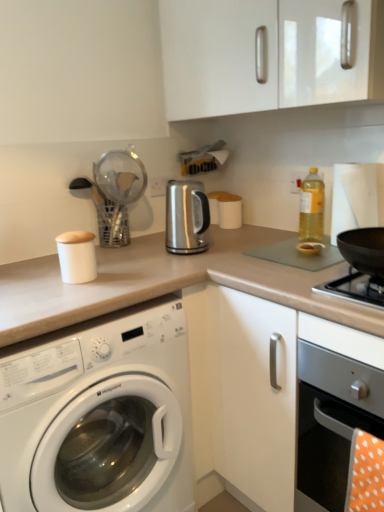
The image size is (384, 512). What do you see at coordinates (186, 217) in the screenshot? I see `satin metallic kettle at center, which is counted as the first appliance, starting from the right` at bounding box center [186, 217].

This screenshot has height=512, width=384. What are the coordinates of `white glossy cabinet at upper center` in the screenshot? It's located at (267, 54).

What do you see at coordinates (267, 54) in the screenshot? I see `white glossy cabinet at upper center` at bounding box center [267, 54].

In order to face white glossy washing machine at lower left, should I rotate leftwards or rightwards?

Rotate left and turn 14.771 degrees.

This screenshot has width=384, height=512. What do you see at coordinates (311, 207) in the screenshot?
I see `yellow translucent bottle at upper right` at bounding box center [311, 207].

Identify the location of black matte wok at right. (363, 249).

The height and width of the screenshot is (512, 384). Find the location of `satin silver oven at lower right`. satin silver oven at lower right is located at coordinates (334, 406).

I want to click on satin metallic kettle at center, acting as the 1th appliance starting from the back, so click(186, 217).

Are white matte canister at left, the 1th appliance positioned from the front, and satin metallic kettle at center, which is the second appliance from left to right, beside each other?

white matte canister at left, the 1th appliance positioned from the front, is not next to satin metallic kettle at center, which is the second appliance from left to right, and they're not touching.

Looking at their sizes, would you say white matte canister at left, the 1th appliance from the left, is wider or thinner than satin metallic kettle at center, which is counted as the first appliance, starting from the right?

In the image, white matte canister at left, the 1th appliance from the left, appears to be more narrow than satin metallic kettle at center, which is counted as the first appliance, starting from the right.

Consider the image. From a real-world perspective, is white matte canister at left, the 1th appliance positioned from the front, on top of satin metallic kettle at center, which is the second appliance from left to right?

No, from a real-world perspective, white matte canister at left, the 1th appliance positioned from the front, is not over satin metallic kettle at center, which is the second appliance from left to right

Considering the positions of point (93, 269) and point (173, 197), is point (93, 269) closer or farther from the camera than point (173, 197)?

Point (93, 269).

Is black matte wok at right inside the boundaries of white glossy cabinet at upper center, or outside?

black matte wok at right is located beyond the bounds of white glossy cabinet at upper center.

How different are the orientations of black matte wok at right and white glossy cabinet at upper center in degrees?

The angular difference between black matte wok at right and white glossy cabinet at upper center is 0.00441 degrees.

Is black matte wok at right to the left of white glossy cabinet at upper center from the viewer's perspective?

In fact, black matte wok at right is to the right of white glossy cabinet at upper center.

Considering the relative sizes of white matte canister at left, the second appliance positioned from the right, and satin silver oven at lower right in the image provided, is white matte canister at left, the second appliance positioned from the right, bigger than satin silver oven at lower right?

Actually, white matte canister at left, the second appliance positioned from the right, might be smaller than satin silver oven at lower right.

Which is behind, white matte canister at left, the 1th appliance from the left, or satin silver oven at lower right?

white matte canister at left, the 1th appliance from the left, is further from the camera.

Is white matte canister at left, positioned as the second appliance in back-to-front order, positioned beyond the bounds of satin silver oven at lower right?

That's correct, white matte canister at left, positioned as the second appliance in back-to-front order, is outside of satin silver oven at lower right.

Considering the positions of objects white glossy washing machine at lower left and satin silver oven at lower right in the image provided, who is more to the left, white glossy washing machine at lower left or satin silver oven at lower right?

From the viewer's perspective, white glossy washing machine at lower left appears more on the left side.

From the image's perspective, which is above, white glossy washing machine at lower left or satin silver oven at lower right?

satin silver oven at lower right appears higher in the image.

Is white glossy washing machine at lower left positioned beyond the bounds of satin silver oven at lower right?

Yes.

Would you say yellow translucent bottle at upper right is to the left or to the right of black matte wok at right in the picture?

Based on their positions, yellow translucent bottle at upper right is located to the left of black matte wok at right.

Is black matte wok at right inside yellow translucent bottle at upper right?

No.

In terms of width, does yellow translucent bottle at upper right look wider or thinner when compared to black matte wok at right?

Clearly, yellow translucent bottle at upper right has less width compared to black matte wok at right.

Identify the location of bottle behind the black matte wok at right. The width and height of the screenshot is (384, 512). (311, 207).

From the image's perspective, does white glossy cabinet at upper center appear higher than satin silver oven at lower right?

Yes, from the image's perspective, white glossy cabinet at upper center is on top of satin silver oven at lower right.

Is white glossy cabinet at upper center to the left of satin silver oven at lower right from the viewer's perspective?

Correct, you'll find white glossy cabinet at upper center to the left of satin silver oven at lower right.

Consider the image. Considering the sizes of objects white glossy cabinet at upper center and satin silver oven at lower right in the image provided, who is smaller, white glossy cabinet at upper center or satin silver oven at lower right?

satin silver oven at lower right is smaller.

Which object is further away from the camera taking this photo, white glossy cabinet at upper center or satin silver oven at lower right?

white glossy cabinet at upper center is further away from the camera.

Which is further, (310, 53) or (205, 228)?

Positioned behind is point (205, 228).

You are a GUI agent. You are given a task and a screenshot of the screen. Output one action in this format:
    pyautogui.click(x=<x>, y=<y>)
    Task: Click on the cabinetry on the right side of satin metallic kettle at center, which is counted as the first appliance, starting from the right
    The image size is (384, 512).
    Given the screenshot: What is the action you would take?
    pyautogui.click(x=267, y=54)

Can you tell me how much white glossy cabinet at upper center and satin metallic kettle at center, which is the second appliance from left to right, differ in facing direction?

The angle between the facing direction of white glossy cabinet at upper center and the facing direction of satin metallic kettle at center, which is the second appliance from left to right, is 90 degrees.

Which is correct: white glossy cabinet at upper center is inside satin metallic kettle at center, which is counted as the first appliance, starting from the right, or outside of it?

white glossy cabinet at upper center is located beyond the bounds of satin metallic kettle at center, which is counted as the first appliance, starting from the right.

This screenshot has width=384, height=512. I want to click on appliance that is above the white matte canister at left, the 1th appliance from the left (from a real-world perspective), so click(186, 217).

Find the location of a particular element. wok that appears below the white glossy cabinet at upper center (from the image's perspective) is located at coordinates coord(363,249).

Looking at the image, which one is located closer to satin metallic kettle at center, which is the second appliance from left to right, satin silver oven at lower right or white glossy cabinet at upper center?

Among the two, white glossy cabinet at upper center is located nearer to satin metallic kettle at center, which is the second appliance from left to right.

Which object lies further to the anchor point white matte canister at left, the 1th appliance from the left, satin silver oven at lower right or satin metallic kettle at center, acting as the second appliance starting from the front?

satin silver oven at lower right is further to white matte canister at left, the 1th appliance from the left.

From the image, which object appears to be nearer to white glossy cabinet at upper center, satin silver oven at lower right or white matte canister at left, the 1th appliance positioned from the front?

Based on the image, white matte canister at left, the 1th appliance positioned from the front, appears to be nearer to white glossy cabinet at upper center.

Which object lies further to the anchor point black matte wok at right, satin metallic kettle at center, acting as the 1th appliance starting from the back, or satin silver oven at lower right?

Among the two, satin metallic kettle at center, acting as the 1th appliance starting from the back, is located further to black matte wok at right.

Estimate the real-world distances between objects in this image. Which object is closer to satin metallic kettle at center, acting as the second appliance starting from the front, satin silver oven at lower right or black matte wok at right?

black matte wok at right is positioned closer to the anchor satin metallic kettle at center, acting as the second appliance starting from the front.

Based on their spatial positions, is satin metallic kettle at center, which is the second appliance from left to right, or white matte canister at left, the second appliance positioned from the right, further from yellow translucent bottle at upper right?

white matte canister at left, the second appliance positioned from the right.

Which object lies further to the anchor point satin silver oven at lower right, white matte canister at left, the 1th appliance from the left, or satin metallic kettle at center, which is counted as the first appliance, starting from the right?

The object further to satin silver oven at lower right is white matte canister at left, the 1th appliance from the left.

From the image, which object appears to be nearer to white glossy cabinet at upper center, yellow translucent bottle at upper right or satin silver oven at lower right?

yellow translucent bottle at upper right is positioned closer to the anchor white glossy cabinet at upper center.

Image resolution: width=384 pixels, height=512 pixels. Identify the location of bottle between white matte canister at left, positioned as the second appliance in back-to-front order, and black matte wok at right from left to right. (311, 207).

This screenshot has height=512, width=384. Find the location of `appliance located between white matte canister at left, the 1th appliance from the left, and black matte wok at right in the left-right direction`. appliance located between white matte canister at left, the 1th appliance from the left, and black matte wok at right in the left-right direction is located at coordinates pos(186,217).

What are the coordinates of `cabinetry situated between white matte canister at left, the second appliance positioned from the right, and black matte wok at right from left to right` in the screenshot? It's located at click(x=267, y=54).

The image size is (384, 512). What are the coordinates of `bottle between white glossy cabinet at upper center and satin silver oven at lower right in the vertical direction` in the screenshot? It's located at (311, 207).